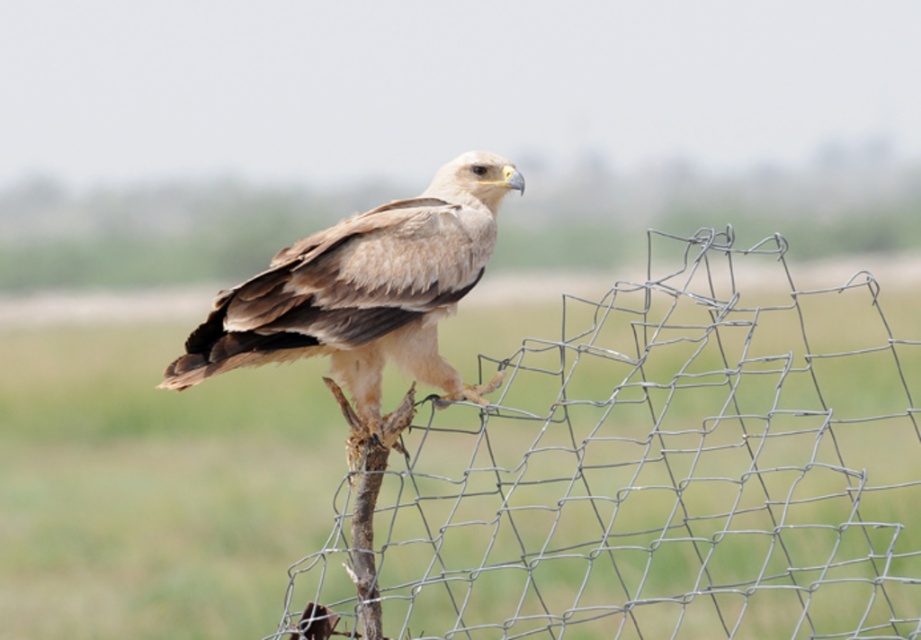
You are a wildlife photographer trying to capture the light brown feathered eagle at center. You notice the wire mesh fence at center is in the way. Can the eagle fit through the gaps in the fence?

The wire mesh fence at center is wider than the light brown feathered eagle at center, so the gaps between the fence wires might be too narrow for the eagle to pass through safely. It is unlikely the eagle can fit through the gaps.

You are a photographer trying to capture the light brown feathered eagle at center. You notice the wire mesh fence at center in the background. Which object is positioned to the right side of the other?

The wire mesh fence at center is to the right of the light brown feathered eagle at center.